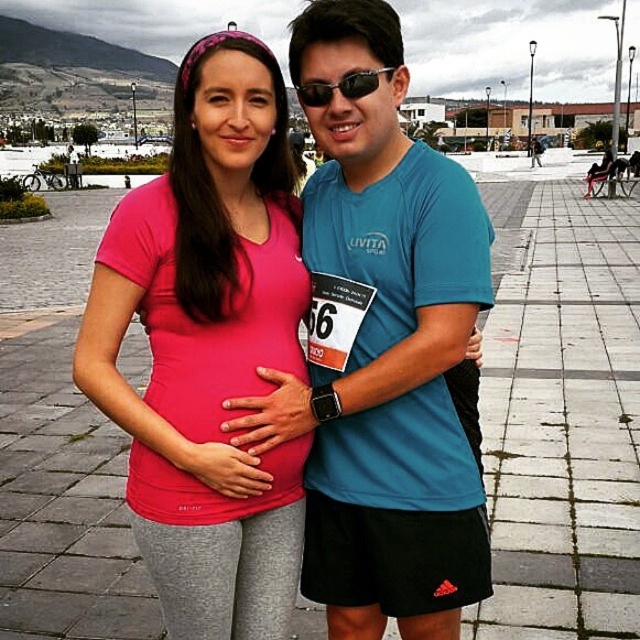
You are standing at the point marked by the coordinates point (561, 416). Looking around, you see the gray concrete pavement at center. What is directly under your feet?

The point marked by the coordinates point (561, 416) is directly on the gray concrete pavement at center.

You are a photographer trying to capture a candid shot of the sunglasses at center without including the gray concrete pavement at center. Based on their positions, is this possible?

The gray concrete pavement at center is above the sunglasses at center, so the pavement is blocking the direct line of sight to the sunglasses. Therefore, capturing the sunglasses at center without the pavement would be challenging unless you adjust your angle or position to frame around the obstruction.

You are standing in the plaza and want to walk from point (602, 564) to point (189, 464). Which direction should you move relative to your current position?

You should move downward and to the left because point (189, 464) is lower and to the left of point (602, 564).